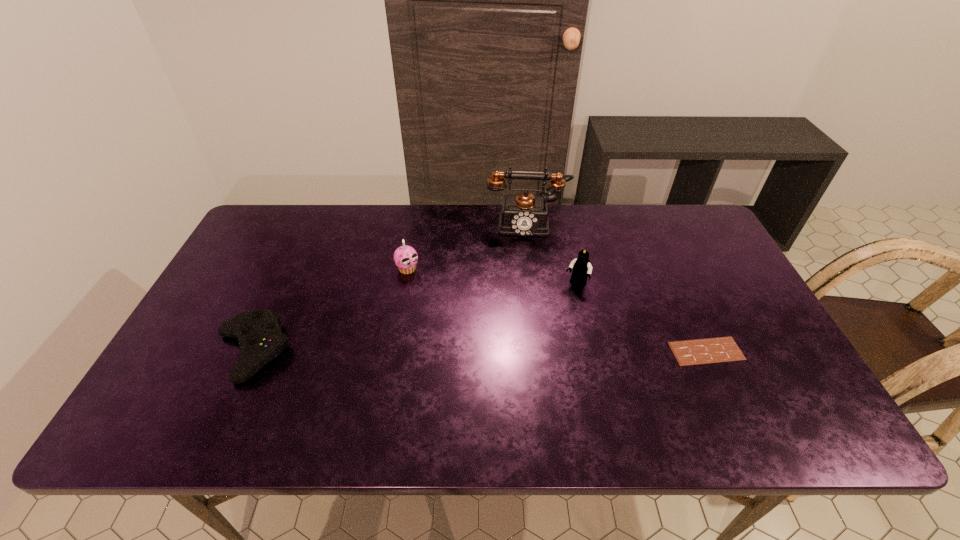
Point out which object is positioned as the second nearest to the second shortest object. Please provide its 2D coordinates. Your answer should be formatted as a tuple, i.e. [(x, y)], where the tuple contains the x and y coordinates of a point satisfying the conditions above.

[(524, 214)]

The image size is (960, 540). What are the coordinates of `vacant space that satisfies the following two spatial constraints: 1. on the back side of the telephone; 2. on the right side of the fourth tallest object` in the screenshot? It's located at (309, 224).